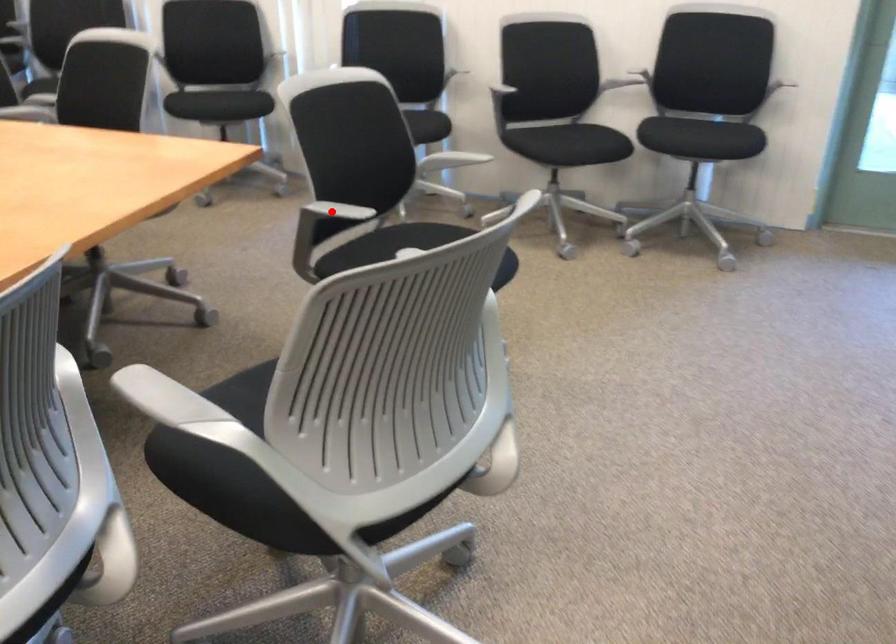
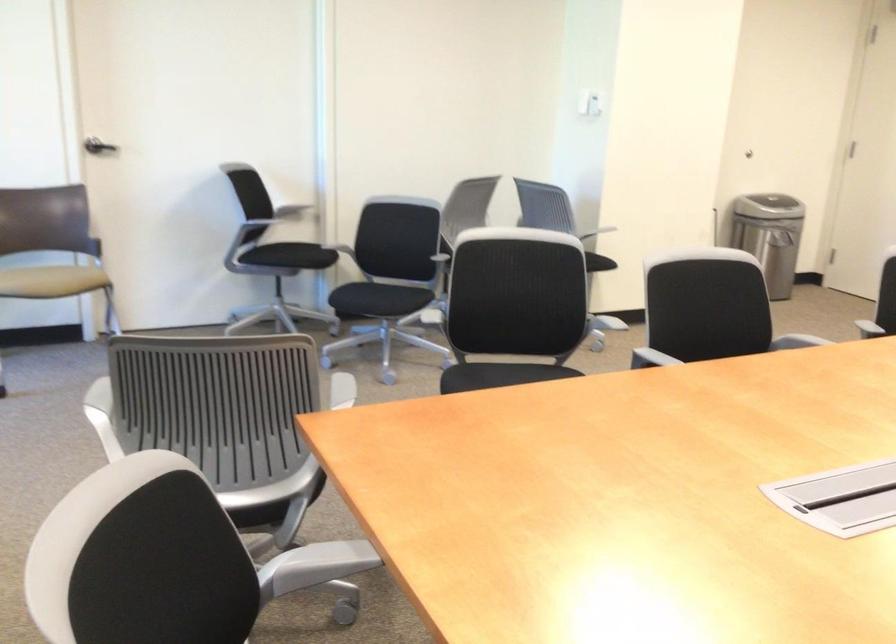
Question: I am providing you with two images of the same scene from different viewpoints. A red point is marked on the first image. Is the red point's position out of view in image 2?

Choices:
 (A) Yes
 (B) No

Answer: (A)